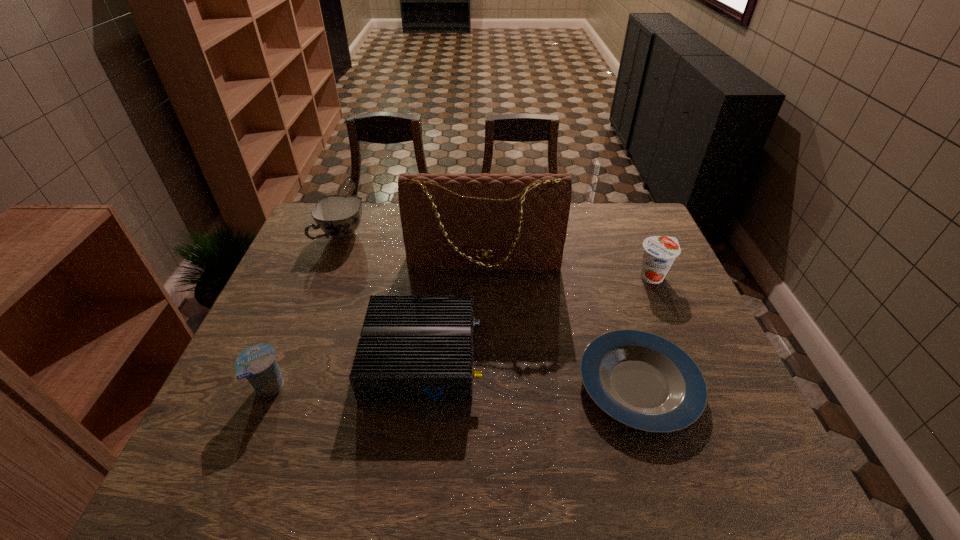
The height and width of the screenshot is (540, 960). I want to click on vacant position in the image that satisfies the following two spatial constraints: 1. on the front-facing side of the tallest object; 2. on the back panel of the router, so click(485, 357).